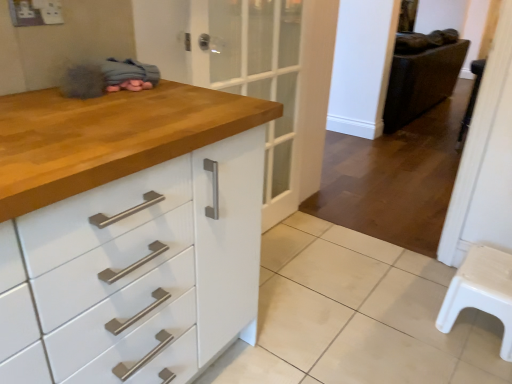
Locate an element on the screen. The width and height of the screenshot is (512, 384). vacant space behind white plastic step stool at right is located at coordinates (434, 138).